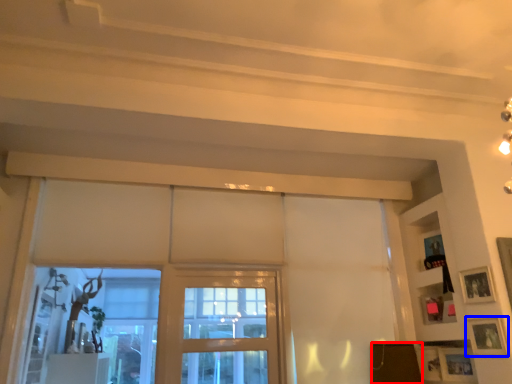
Question: Which object is further to the camera taking this photo, furniture (highlighted by a red box) or picture frame (highlighted by a blue box)?

Choices:
 (A) furniture
 (B) picture frame

Answer: (A)